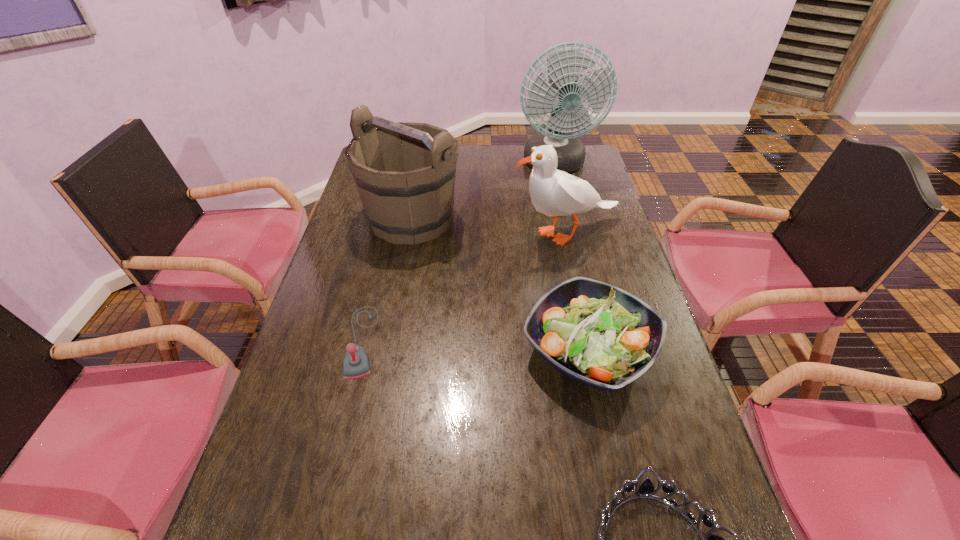
Find the location of a particular element. The height and width of the screenshot is (540, 960). object identified as the third closest to the tallest object is located at coordinates point(595,333).

Locate an element on the screen. The height and width of the screenshot is (540, 960). the fifth closest object relative to the fan is located at coordinates (646, 490).